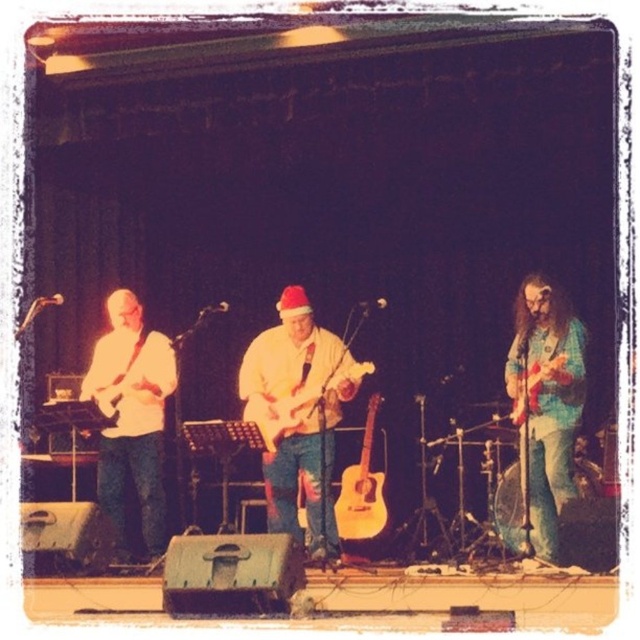
Question: Based on their relative distances, which object is nearer to the white matte guitar at center?

Choices:
 (A) shiny teal shirt at right
 (B) wooden acoustic guitar at right

Answer: (A)

Question: Which of the following is the closest to the observer?

Choices:
 (A) (557, 356)
 (B) (532, 385)
 (C) (362, 529)

Answer: (A)

Question: Does white matte guitar at center appear over shiny teal shirt at right?

Choices:
 (A) yes
 (B) no

Answer: (B)

Question: Is white matte guitar at center further to camera compared to wooden acoustic guitar at right?

Choices:
 (A) yes
 (B) no

Answer: (A)

Question: Which of these objects is positioned farthest from the white matte guitar at left?

Choices:
 (A) shiny teal shirt at right
 (B) white glossy electric guitar at center

Answer: (A)

Question: Does white matte guitar at left appear over white glossy electric guitar at center?

Choices:
 (A) yes
 (B) no

Answer: (B)